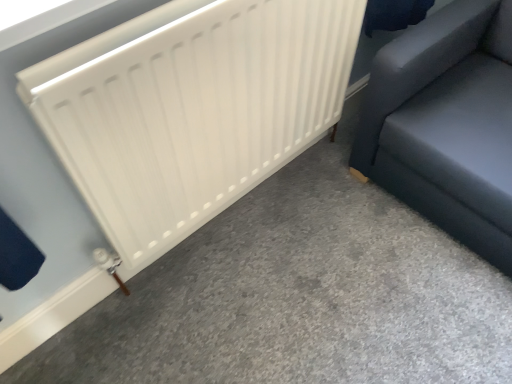
Question: From a real-world perspective, does white matte radiator at left sit lower than white matte radiator at center?

Choices:
 (A) yes
 (B) no

Answer: (A)

Question: Can you confirm if white matte radiator at left is positioned to the left of white matte radiator at center?

Choices:
 (A) no
 (B) yes

Answer: (A)

Question: Are white matte radiator at left and white matte radiator at center located far from each other?

Choices:
 (A) no
 (B) yes

Answer: (A)

Question: Considering the relative sizes of white matte radiator at left and white matte radiator at center in the image provided, is white matte radiator at left bigger than white matte radiator at center?

Choices:
 (A) yes
 (B) no

Answer: (B)

Question: Considering the relative sizes of white matte radiator at left and white matte radiator at center in the image provided, is white matte radiator at left thinner than white matte radiator at center?

Choices:
 (A) yes
 (B) no

Answer: (B)

Question: Is dark gray fabric sofa at right situated inside white matte radiator at center or outside?

Choices:
 (A) inside
 (B) outside

Answer: (B)

Question: Considering their positions, is dark gray fabric sofa at right located in front of or behind white matte radiator at center?

Choices:
 (A) behind
 (B) front

Answer: (A)

Question: From the image's perspective, is dark gray fabric sofa at right above or below white matte radiator at center?

Choices:
 (A) above
 (B) below

Answer: (A)

Question: Considering the relative positions of dark gray fabric sofa at right and white matte radiator at center in the image provided, is dark gray fabric sofa at right to the left or to the right of white matte radiator at center?

Choices:
 (A) right
 (B) left

Answer: (A)

Question: From the image's perspective, is white matte radiator at center located above or below white matte radiator at left?

Choices:
 (A) below
 (B) above

Answer: (B)

Question: Is point (305, 132) closer or farther from the camera than point (300, 188)?

Choices:
 (A) farther
 (B) closer

Answer: (B)

Question: Based on their sizes in the image, would you say white matte radiator at center is bigger or smaller than white matte radiator at left?

Choices:
 (A) big
 (B) small

Answer: (A)

Question: Would you say white matte radiator at center is inside or outside white matte radiator at left?

Choices:
 (A) inside
 (B) outside

Answer: (B)

Question: Does point (421, 321) appear closer or farther from the camera than point (147, 183)?

Choices:
 (A) farther
 (B) closer

Answer: (A)

Question: From the image's perspective, is white matte radiator at left positioned above or below white matte radiator at center?

Choices:
 (A) below
 (B) above

Answer: (A)